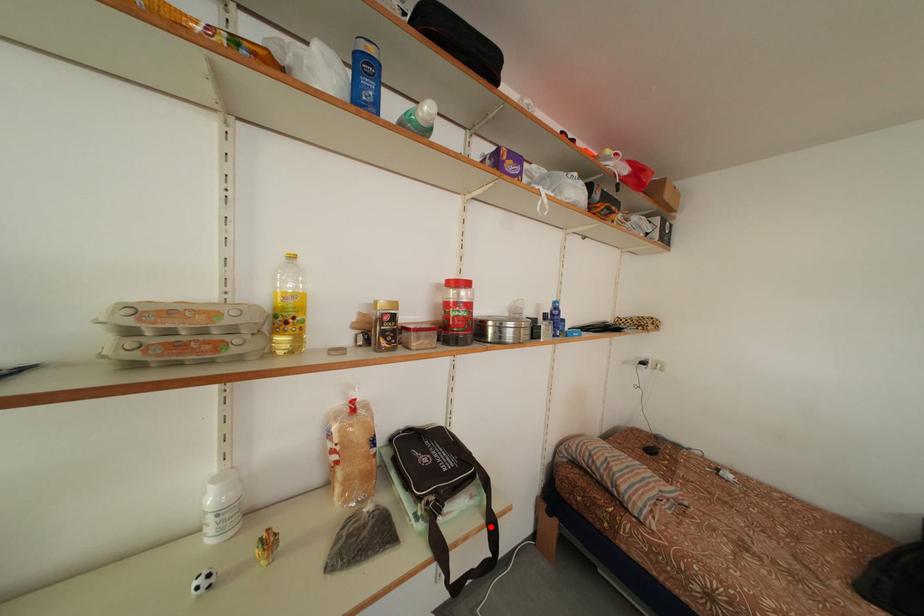
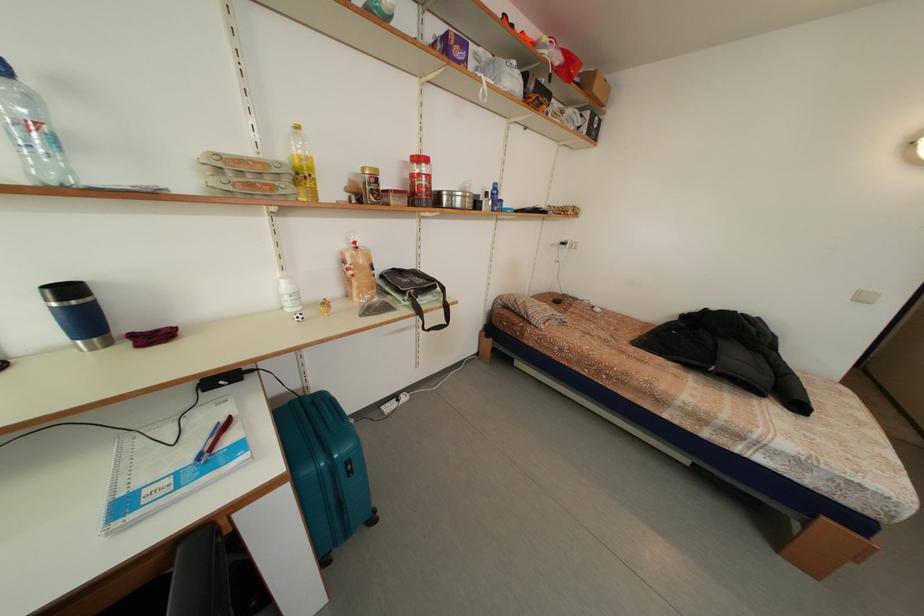
The point at the highlighted location is marked in the first image. Where is the corresponding point in the second image?

(448, 310)